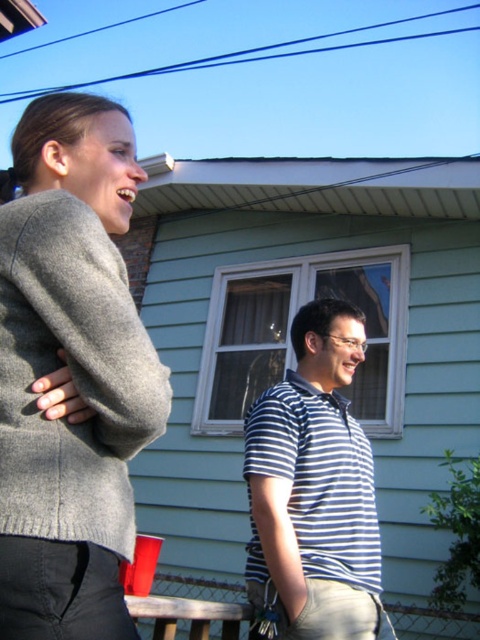
Can you confirm if gray wool sweater at upper left is smaller than blue striped shirt at center?

Correct, gray wool sweater at upper left occupies less space than blue striped shirt at center.

Is point (57, 140) positioned in front of point (301, 490)?

That is True.

Image resolution: width=480 pixels, height=640 pixels. Find the location of `gray wool sweater at upper left`. gray wool sweater at upper left is located at coordinates coord(71,371).

This screenshot has width=480, height=640. I want to click on gray wool sweater at upper left, so click(71, 371).

Is gray wool sweater at left below blue striped shirt at center?

No.

Is point (93, 552) closer to camera compared to point (332, 566)?

Yes, point (93, 552) is closer to viewer.

Which is behind, point (87, 216) or point (261, 442)?

Positioned behind is point (261, 442).

I want to click on gray wool sweater at left, so click(71, 371).

Who is positioned more to the left, gray wool sweater at upper left or gray wool sweater at left?

gray wool sweater at upper left

Does gray wool sweater at upper left lie behind gray wool sweater at left?

Yes, gray wool sweater at upper left is further from the viewer.

Between point (75, 269) and point (106, 228), which one is positioned behind?

The point (106, 228) is behind.

You are a GUI agent. You are given a task and a screenshot of the screen. Output one action in this format:
    pyautogui.click(x=<x>, y=<y>)
    Task: Click on the gray wool sweater at upper left
    The height and width of the screenshot is (640, 480).
    Given the screenshot: What is the action you would take?
    pyautogui.click(x=71, y=371)